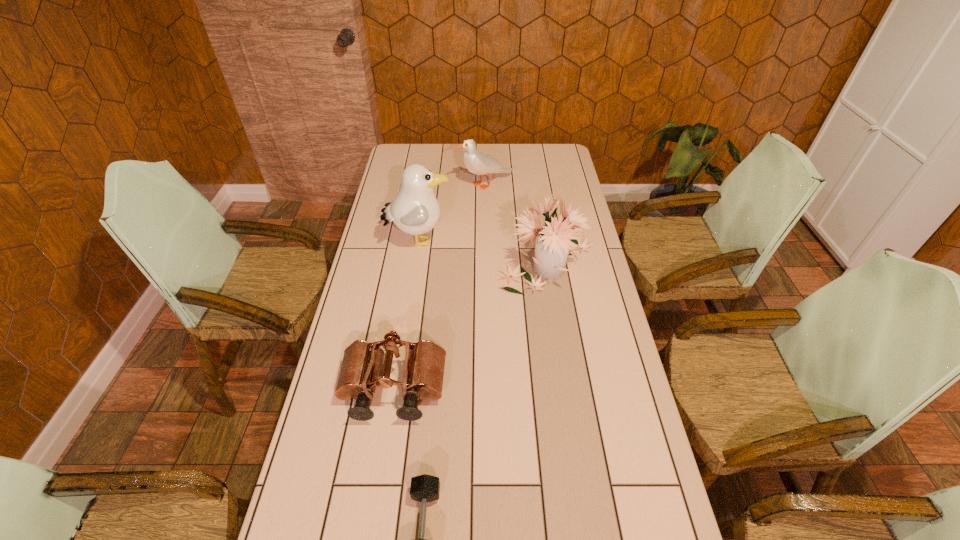
The height and width of the screenshot is (540, 960). What are the coordinates of `free space between the bouquet and the right gull` in the screenshot? It's located at (516, 223).

Locate an element on the screen. The height and width of the screenshot is (540, 960). free space between the third shortest object and the left gull is located at coordinates (452, 213).

You are a GUI agent. You are given a task and a screenshot of the screen. Output one action in this format:
    pyautogui.click(x=<x>, y=<y>)
    Task: Click on the empty location between the binoculars and the nearer gull
    Image resolution: width=960 pixels, height=540 pixels.
    Given the screenshot: What is the action you would take?
    pyautogui.click(x=406, y=315)

Identify the location of free spot between the taller gull and the bouquet. The image size is (960, 540). (483, 251).

In order to click on free space between the left gull and the bouquet in this screenshot , I will do `click(483, 251)`.

At what (x,y) coordinates should I click in order to perform the action: click on vacant area that lies between the left gull and the second nearest object. Please return your answer as a coordinate pair (x, y). This screenshot has height=540, width=960. Looking at the image, I should click on (406, 315).

I want to click on the closest object to the left gull, so click(553, 239).

Locate which object ranks in proximity to the shortest object. Please provide its 2D coordinates. Your answer should be formatted as a tuple, i.e. [(x, y)], where the tuple contains the x and y coordinates of a point satisfying the conditions above.

[(424, 364)]

In order to click on vacant area in the image that satisfies the following two spatial constraints: 1. on the beak of the bouquet; 2. on the right side of the left gull in this screenshot , I will do `click(416, 261)`.

Locate an element on the screen. This screenshot has height=540, width=960. vacant space that satisfies the following two spatial constraints: 1. at the beak of the bouquet; 2. on the right side of the right gull is located at coordinates (488, 261).